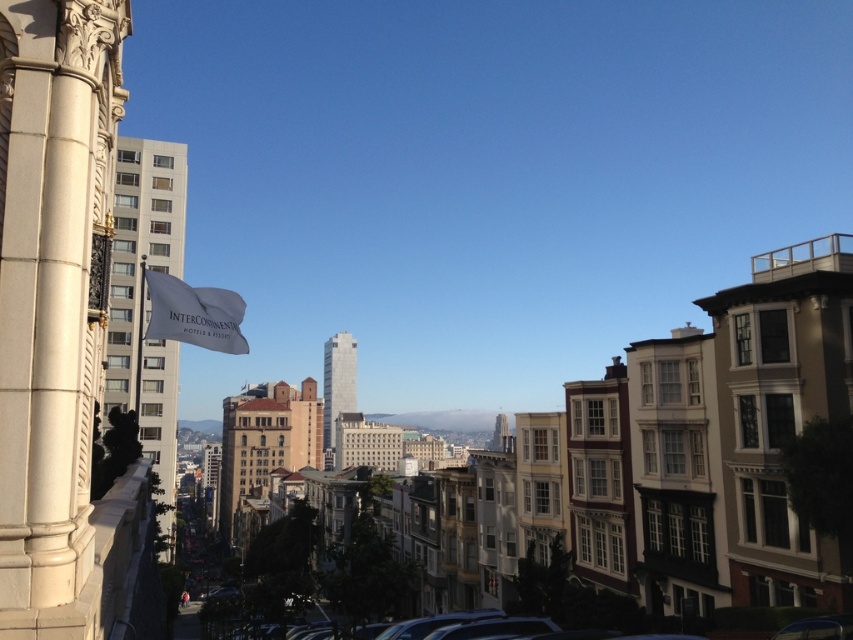
Does point (90, 227) come farther from viewer compared to point (175, 339)?

No, it is not.

Between white stone column at left and white fabric flag at upper left, which one has less height?

With less height is white fabric flag at upper left.

Is point (77, 10) less distant than point (155, 284)?

Yes, it is in front of point (155, 284).

Identify the location of white stone column at left. Image resolution: width=853 pixels, height=640 pixels. (55, 308).